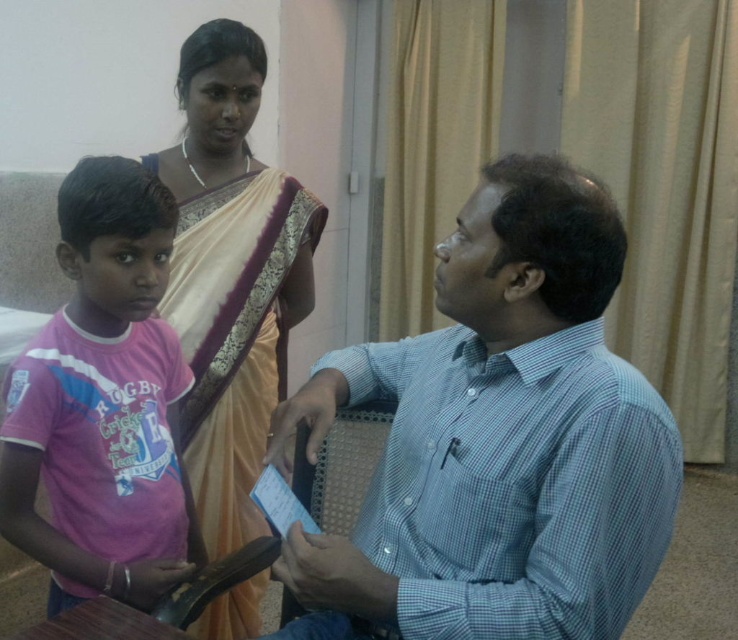
Question: Considering the real-world distances, which object is farthest from the pink jersey at left?

Choices:
 (A) beige silk saree at upper center
 (B) blue checkered shirt at right

Answer: (A)

Question: Which object is farther from the camera taking this photo?

Choices:
 (A) blue checkered shirt at right
 (B) beige silk saree at upper center

Answer: (B)

Question: Where is blue checkered shirt at right located in relation to pink jersey at left in the image?

Choices:
 (A) above
 (B) below

Answer: (B)

Question: Is blue checkered shirt at right above pink jersey at left?

Choices:
 (A) yes
 (B) no

Answer: (B)

Question: Is blue checkered shirt at right further to camera compared to pink jersey at left?

Choices:
 (A) yes
 (B) no

Answer: (B)

Question: Which point is farther from the camera taking this photo?

Choices:
 (A) (41, 378)
 (B) (200, 260)

Answer: (B)